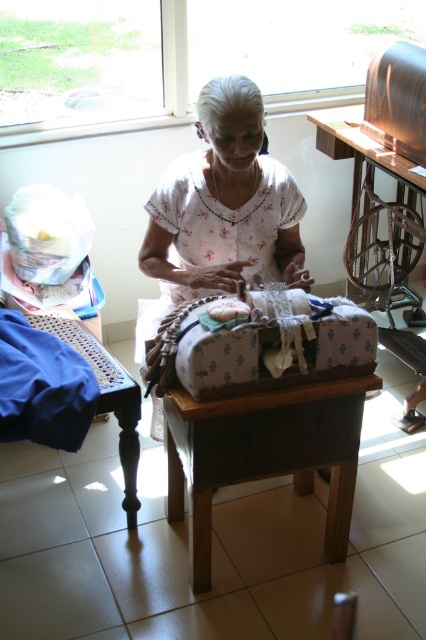
Question: Is white floral shirt at center bigger than brown wooden table at center?

Choices:
 (A) no
 (B) yes

Answer: (A)

Question: Among these points, which one is farthest from the camera?

Choices:
 (A) (51, 422)
 (B) (284, 397)

Answer: (A)

Question: Is brown wooden table at center below wooden chair at center?

Choices:
 (A) yes
 (B) no

Answer: (A)

Question: Which point is closer to the camera?

Choices:
 (A) white floral shirt at center
 (B) wooden chair at center
 (C) blue fabric at lower left

Answer: (C)

Question: Is white floral shirt at center below blue fabric at lower left?

Choices:
 (A) yes
 (B) no

Answer: (B)

Question: Estimate the real-world distances between objects in this image. Which object is farther from the brown wooden table at center?

Choices:
 (A) wooden chair at center
 (B) white floral shirt at center
 (C) blue fabric at lower left

Answer: (A)